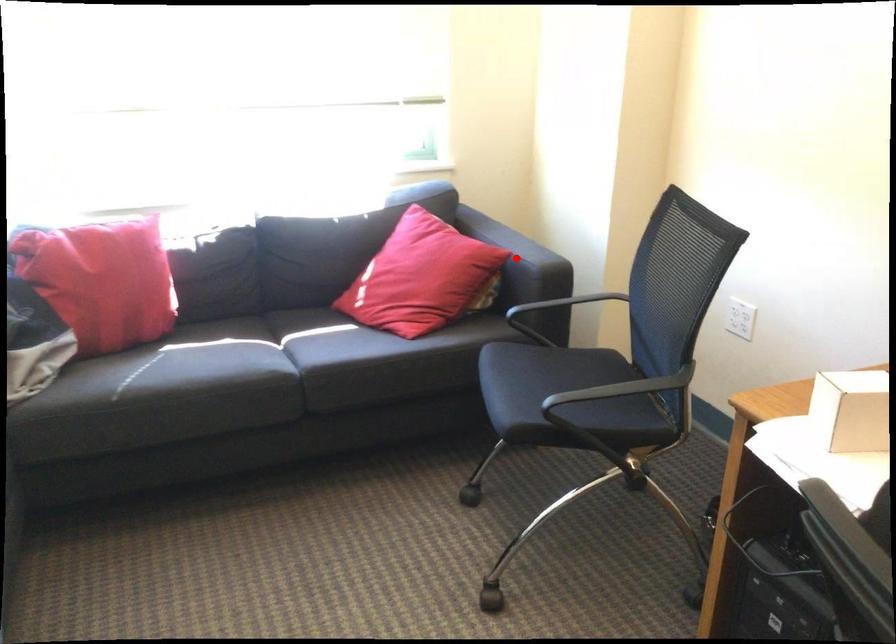
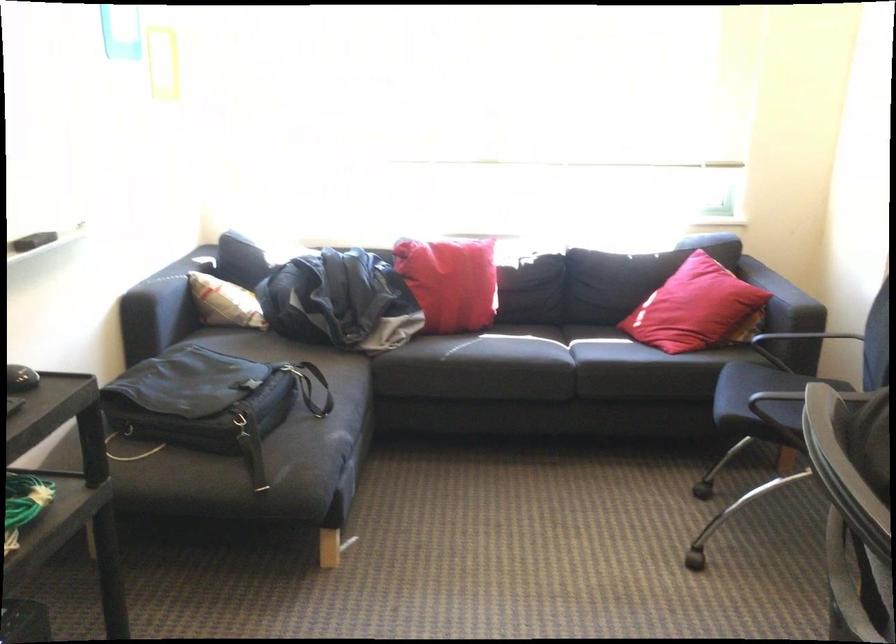
Where in the second image is the point corresponding to the highlighted location from the first image?

(782, 298)